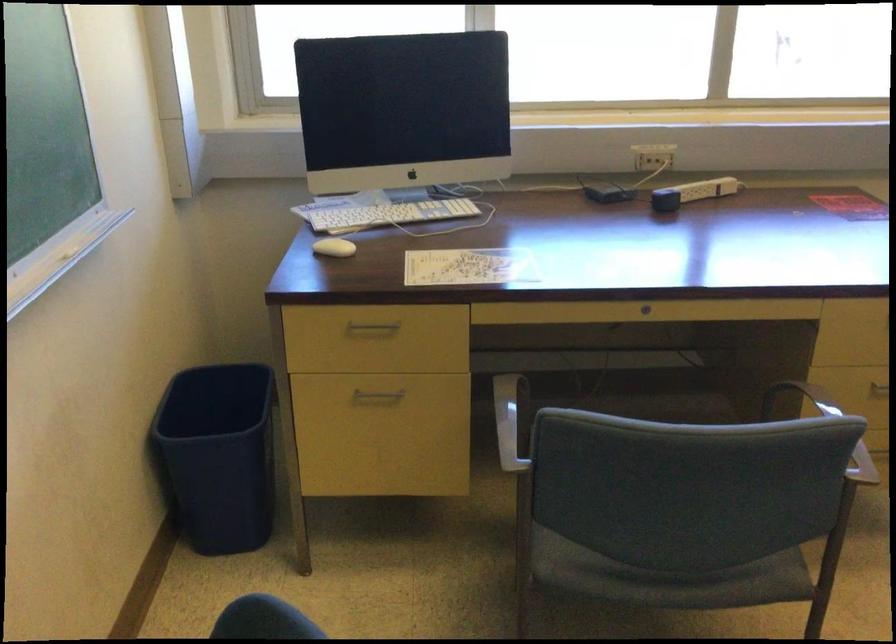
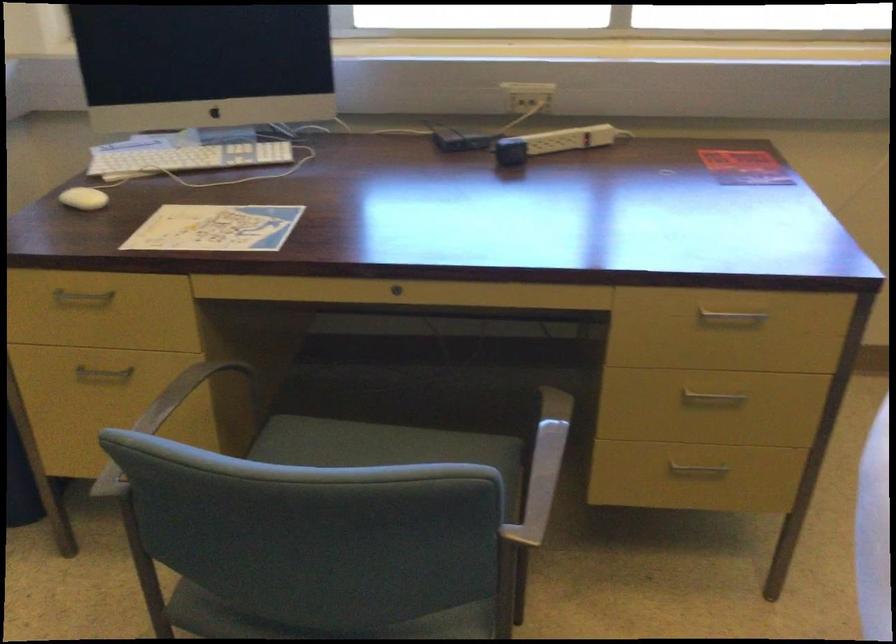
What movement of the cameraman would produce the second image?

The cameraman walked toward right, forward.